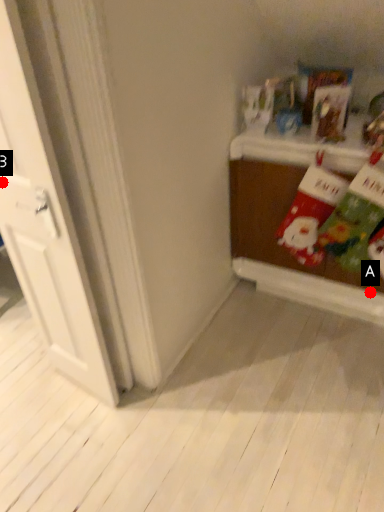
Question: Two points are circled on the image, labeled by A and B beside each circle. Which point is closer to the camera taking this photo?

Choices:
 (A) A is closer
 (B) B is closer

Answer: (B)